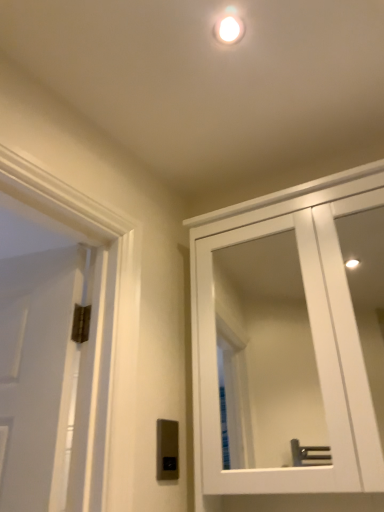
Question: Is point (365, 470) closer or farther from the camera than point (226, 19)?

Choices:
 (A) farther
 (B) closer

Answer: (B)

Question: From a real-world perspective, relative to white glossy droplight at upper center, is white glossy cabinet at upper right vertically above or below?

Choices:
 (A) below
 (B) above

Answer: (A)

Question: Which object is the closest to the white glossy cabinet at upper right?

Choices:
 (A) satin silver switch at lower center
 (B) white glossy droplight at upper center

Answer: (A)

Question: Which is nearer to the white glossy cabinet at upper right?

Choices:
 (A) satin silver switch at lower center
 (B) white glossy droplight at upper center

Answer: (A)